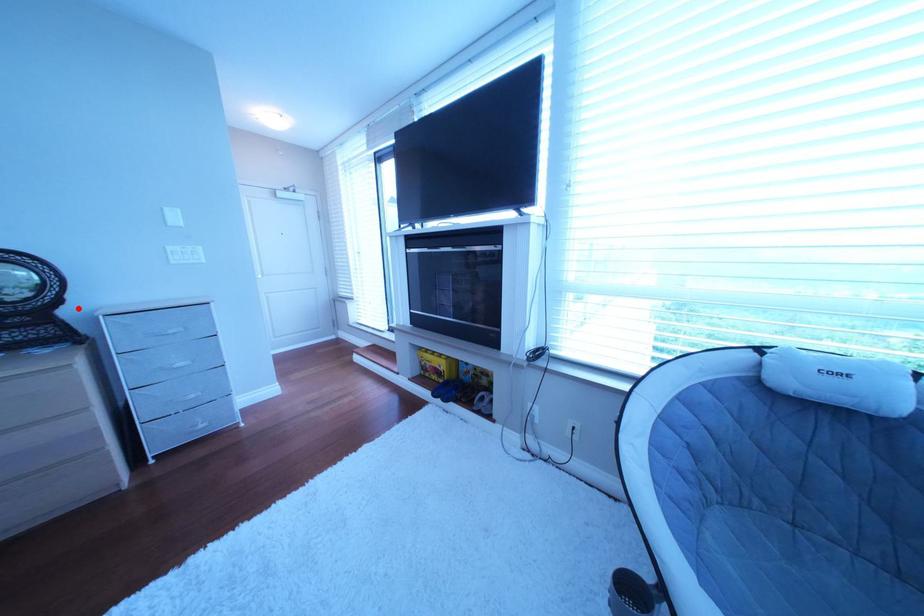
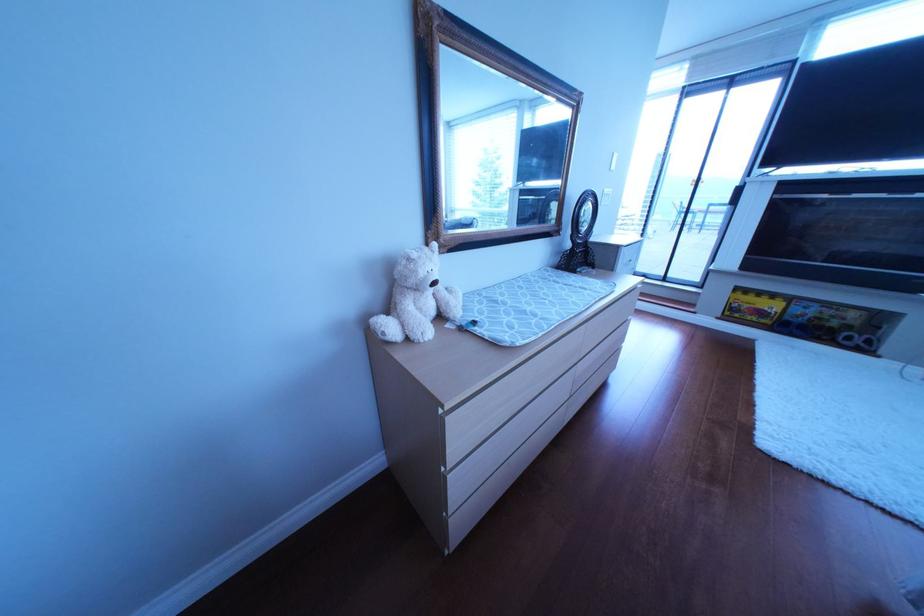
The point at the highlighted location is marked in the first image. Where is the corresponding point in the second image?

(605, 240)